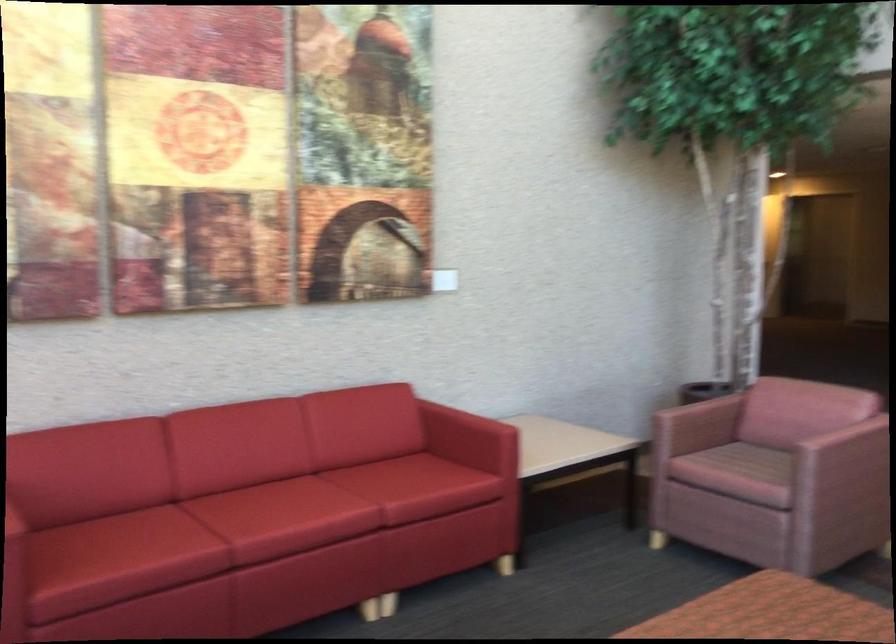
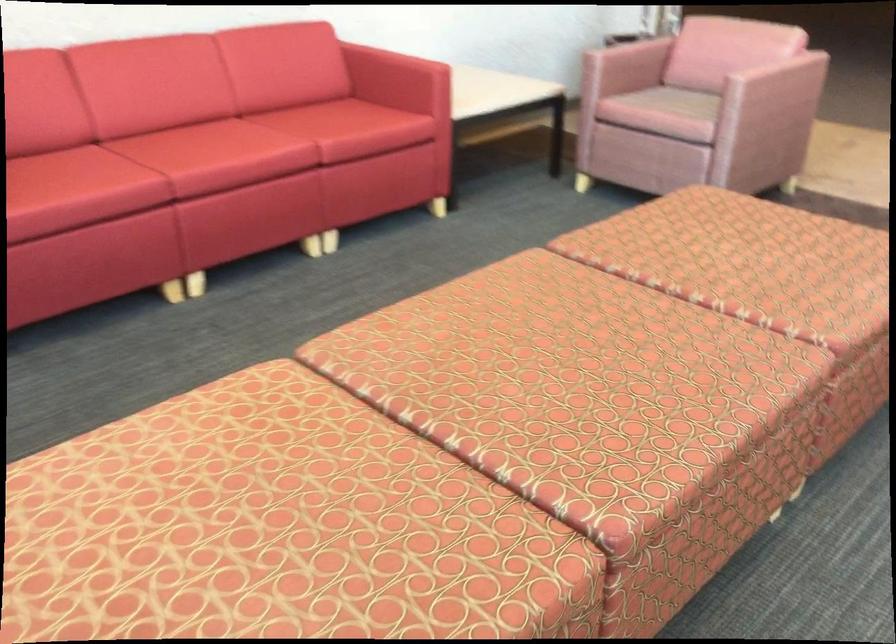
Question: Based on the continuous images, in which direction is the camera rotating? Reply with the corresponding letter.

Choices:
 (A) Left
 (B) Right
 (C) Up
 (D) Down

Answer: (D)